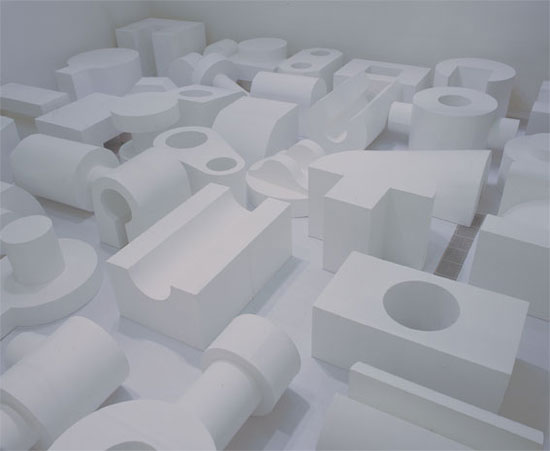
This screenshot has width=550, height=451. What are the coordinates of `wall` in the screenshot? It's located at (407, 35).